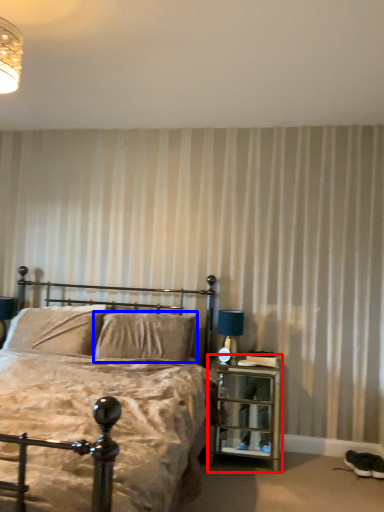
Question: Which of the following is the closest to the observer, nightstand (highlighted by a red box) or pillow (highlighted by a blue box)?

Choices:
 (A) nightstand
 (B) pillow

Answer: (A)